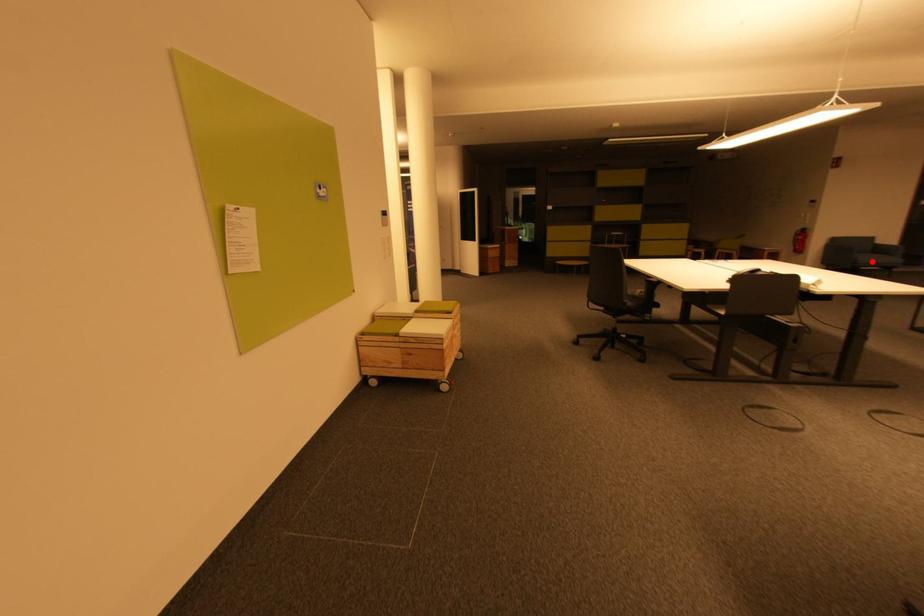
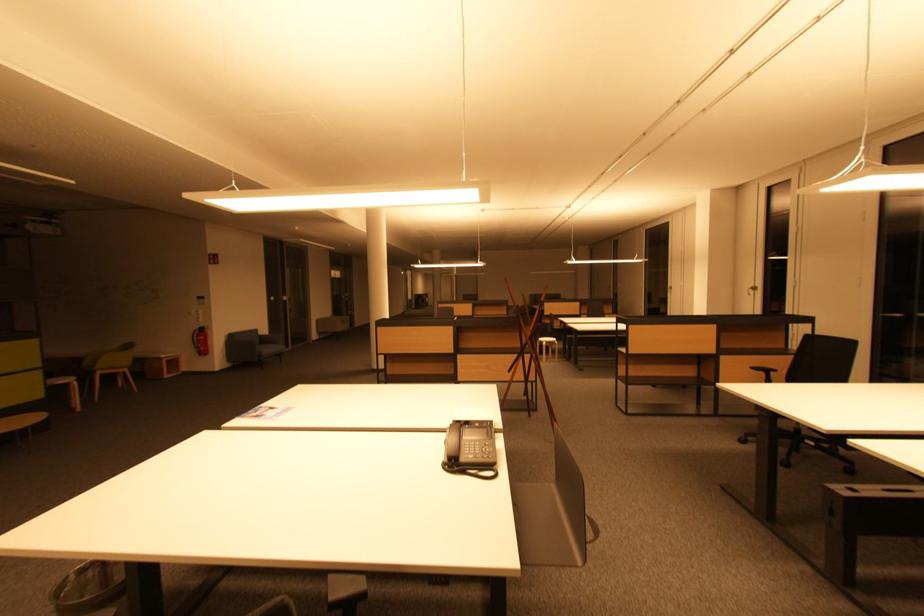
Question: I am providing you with two images of the same scene from different viewpoints. In image1, a red point is highlighted. Considering the same 3D point in image2, which of the following is correct?

Choices:
 (A) It is closer
 (B) It is farther

Answer: (A)